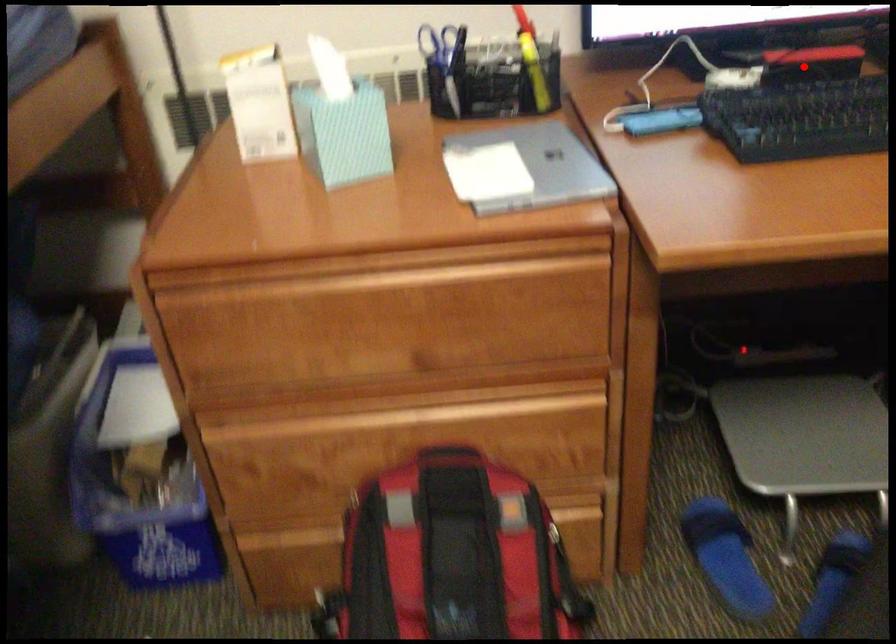
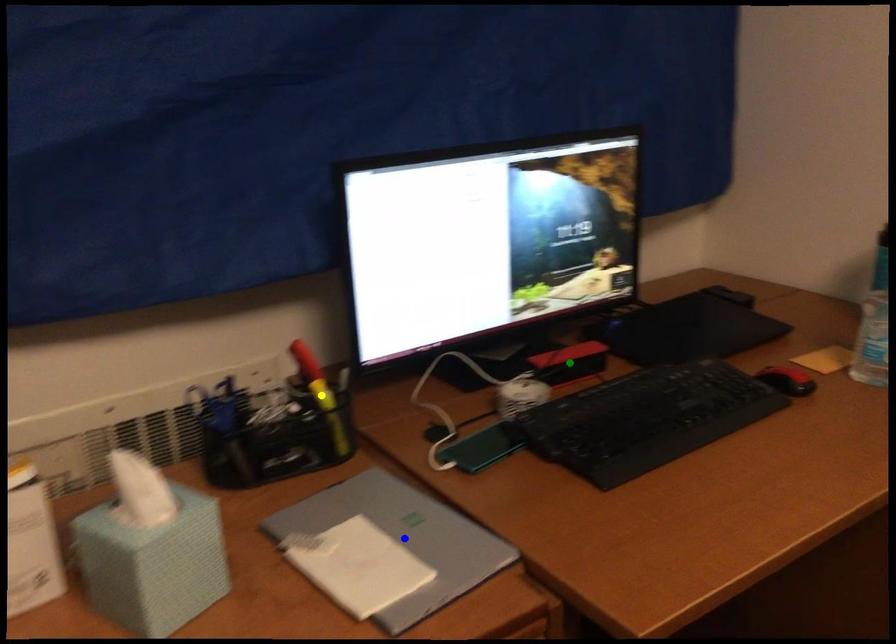
Question: I am providing you with two images of the same scene from different viewpoints. A red point is marked on the first image. You are given multiple points on the second image. In image 2, which mark is for the same physical point as the one in image 1?

Choices:
 (A) green point
 (B) yellow point
 (C) blue point

Answer: (A)